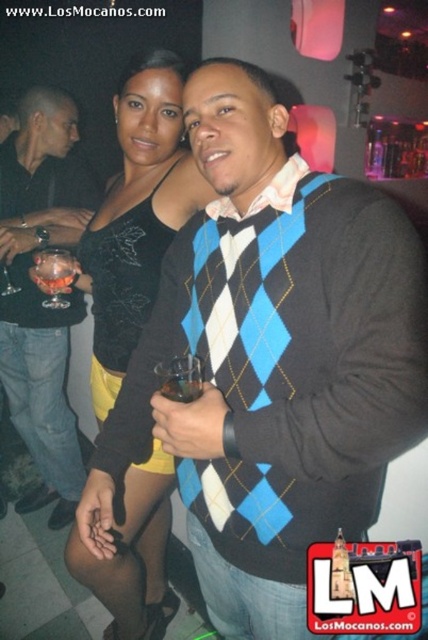
You are at a party and want to grab a drink without spilling it. You see two transparent glasses in your view. Which glass, the transparent glass at upper left or the transparent glass at lower left, is less likely to spill if you move it?

The transparent glass at upper left is positioned under the transparent glass at lower left, so moving the transparent glass at lower left first would be less likely to cause spillage since it is above and might be steadier. However, if you must move the transparent glass at upper left, ensure caution as it is beneath the other glass.

You are at a party and want to grab a drink from the table. There are two glasses in front of you, the transparent glass at upper left and the translucent glass cup at center. Which glass is closer to you?

The transparent glass at upper left is closer to you since the translucent glass cup at center is behind it.